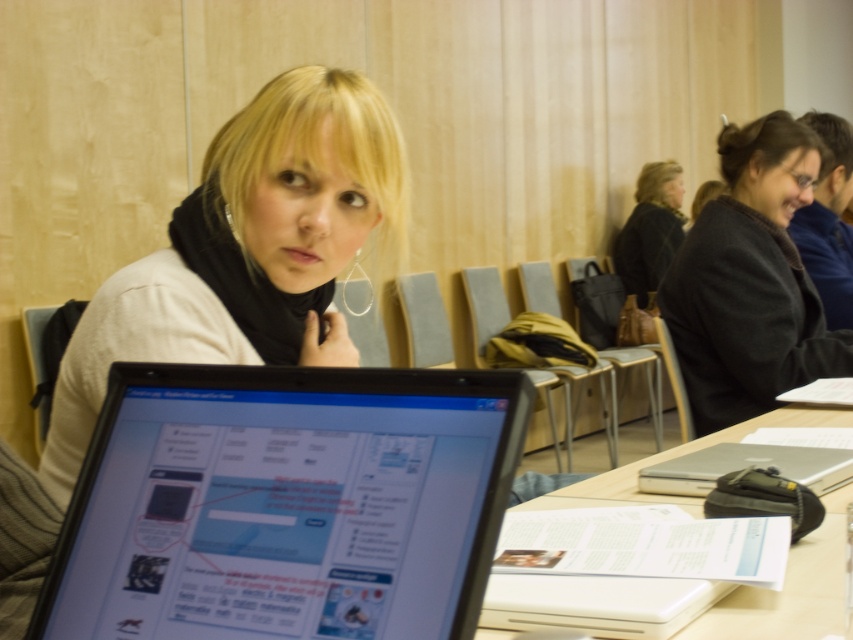
Question: Is shiny black laptop at center thinner than dark gray wool coat at center?

Choices:
 (A) yes
 (B) no

Answer: (A)

Question: Can you confirm if matte black scarf at center is thinner than dark gray wool coat at center?

Choices:
 (A) yes
 (B) no

Answer: (A)

Question: Which of the following is the closest to the observer?

Choices:
 (A) (640, 193)
 (B) (234, 230)

Answer: (B)

Question: Does matte black scarf at center appear under black fabric jacket at upper right?

Choices:
 (A) yes
 (B) no

Answer: (A)

Question: Which object is farther from the camera taking this photo?

Choices:
 (A) white paper at center
 (B) matte black scarf at center

Answer: (B)

Question: Which point is closer to the camera?

Choices:
 (A) (839, 417)
 (B) (451, 577)
 (C) (369, 96)
 (D) (641, 195)

Answer: (B)